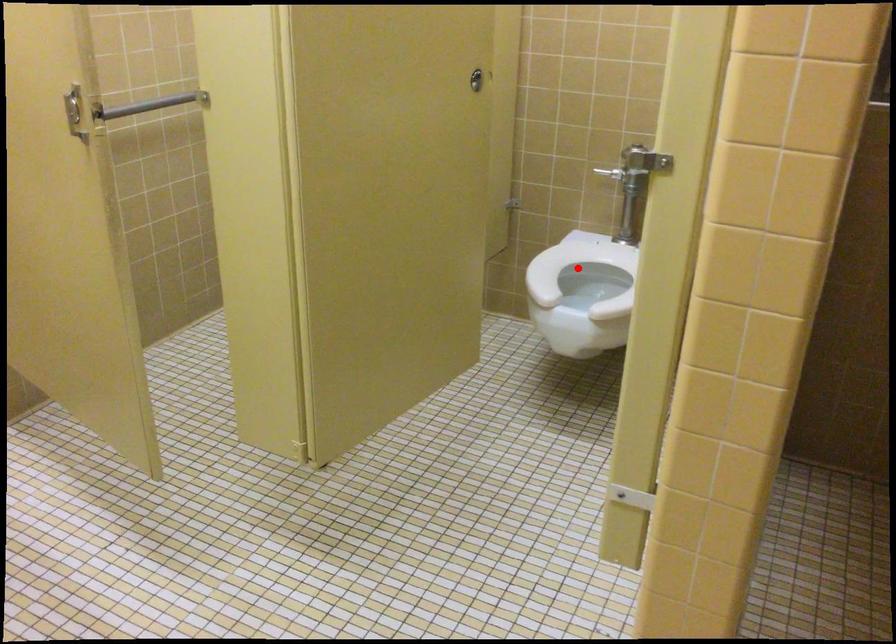
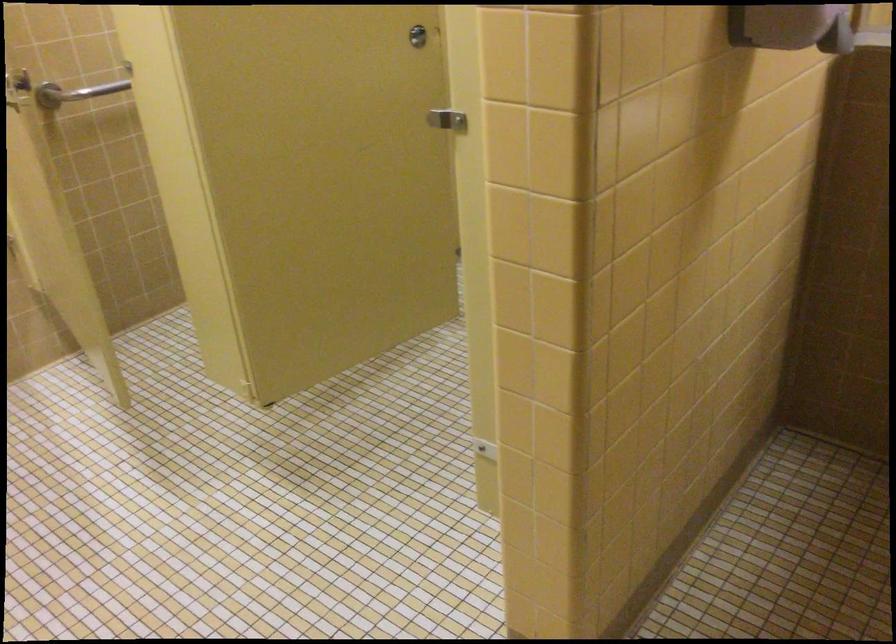
Question: I am providing you with two images of the same scene from different viewpoints. A red point is marked on the first image. Is the red point's position out of view in image 2?

Choices:
 (A) Yes
 (B) No

Answer: (A)